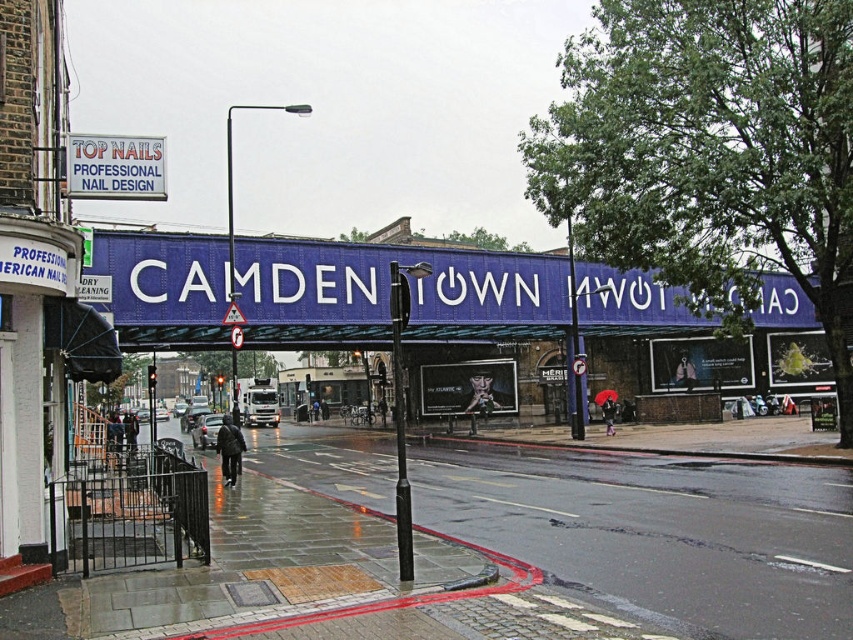
Who is shorter, concrete sidewalk at lower left or matte black umbrella at center?

matte black umbrella at center is shorter.

Can you confirm if concrete sidewalk at lower left is positioned to the right of matte black umbrella at center?

No, concrete sidewalk at lower left is not to the right of matte black umbrella at center.

What do you see at coordinates (659, 532) in the screenshot? I see `concrete sidewalk at lower left` at bounding box center [659, 532].

Locate an element on the screen. This screenshot has width=853, height=640. concrete sidewalk at lower left is located at coordinates (659, 532).

Can you confirm if concrete sidewalk at lower left is taller than white plastic sign at upper left?

Yes, concrete sidewalk at lower left is taller than white plastic sign at upper left.

Does concrete sidewalk at lower left lie in front of white plastic sign at upper left?

Yes, it is in front of white plastic sign at upper left.

Is point (799, 474) closer to camera compared to point (148, 189)?

No, (799, 474) is further to viewer.

You are a GUI agent. You are given a task and a screenshot of the screen. Output one action in this format:
    pyautogui.click(x=<x>, y=<y>)
    Task: Click on the concrete sidewalk at lower left
    Image resolution: width=853 pixels, height=640 pixels.
    Given the screenshot: What is the action you would take?
    pyautogui.click(x=659, y=532)

Is white plastic sign at upper left above matte black umbrella at center?

Indeed, white plastic sign at upper left is positioned over matte black umbrella at center.

Is white plastic sign at upper left smaller than matte black umbrella at center?

No, white plastic sign at upper left is not smaller than matte black umbrella at center.

This screenshot has width=853, height=640. What do you see at coordinates (115, 168) in the screenshot?
I see `white plastic sign at upper left` at bounding box center [115, 168].

This screenshot has width=853, height=640. I want to click on white plastic sign at upper left, so click(115, 168).